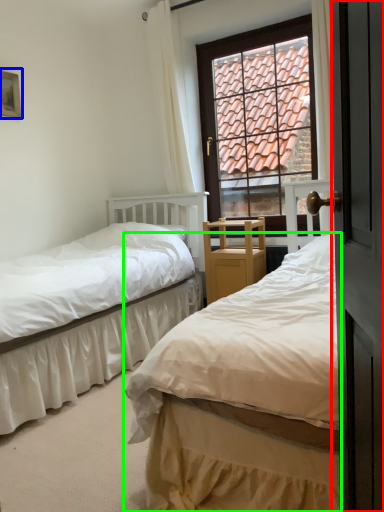
Question: Based on their relative distances, which object is nearer to screen door (highlighted by a red box)? Choose from picture frame (highlighted by a blue box) and bed (highlighted by a green box).

Choices:
 (A) picture frame
 (B) bed

Answer: (B)